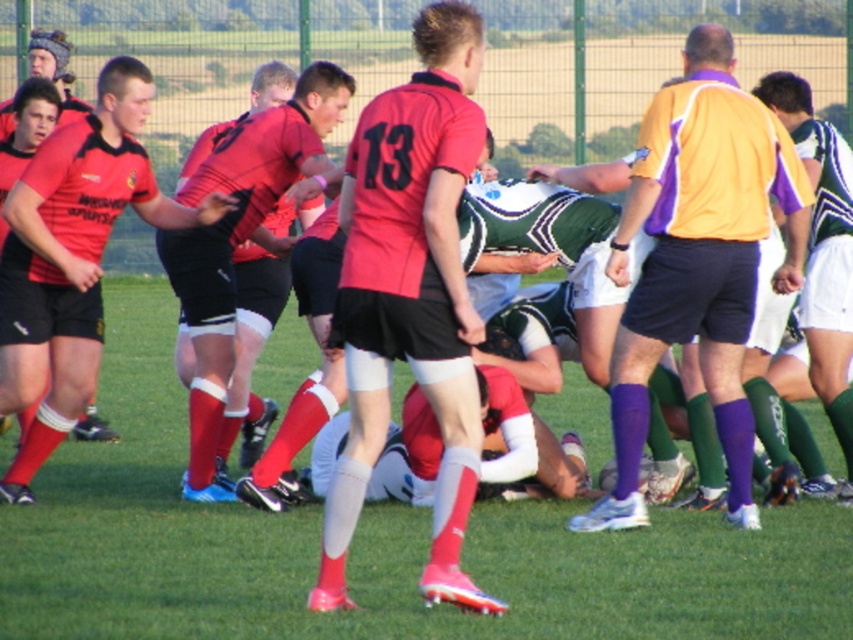
Question: Which point appears closest to the camera in this image?

Choices:
 (A) (440, 289)
 (B) (850, 481)

Answer: (A)

Question: Can you confirm if matte red jersey at center is wider than matte red socks at center?

Choices:
 (A) no
 (B) yes

Answer: (A)

Question: Which of the following is the closest to the observer?

Choices:
 (A) matte red jersey at center
 (B) matte red socks at center
 (C) orange and purple jersey at center

Answer: (A)

Question: Is orange and purple jersey at center positioned in front of matte red socks at center?

Choices:
 (A) yes
 (B) no

Answer: (A)

Question: Which object is farther from the camera taking this photo?

Choices:
 (A) green striped jersey at center
 (B) matte red jersey at center

Answer: (A)

Question: Can you confirm if matte red socks at center is positioned above green striped jersey at center?

Choices:
 (A) yes
 (B) no

Answer: (A)